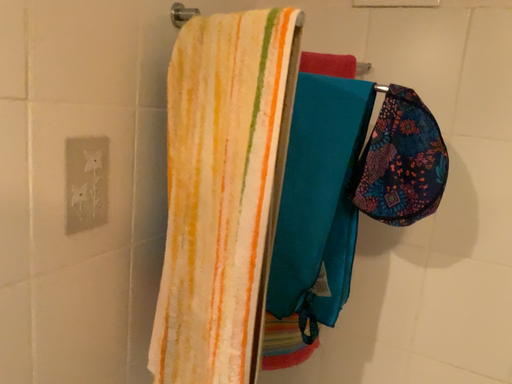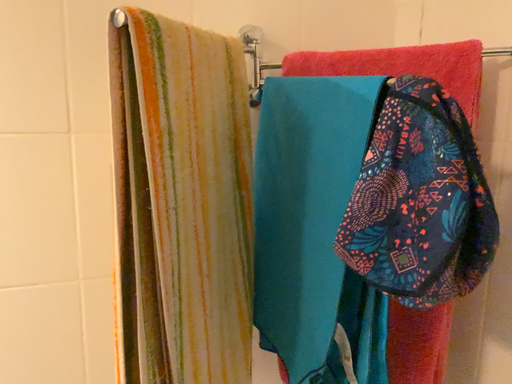
Question: Which way did the camera rotate in the video?

Choices:
 (A) rotated downward
 (B) rotated upward

Answer: (B)